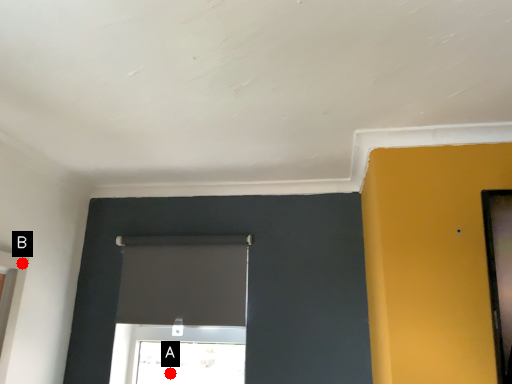
Question: Two points are circled on the image, labeled by A and B beside each circle. Which of the following is the farthest from the observer?

Choices:
 (A) A is further
 (B) B is further

Answer: (A)